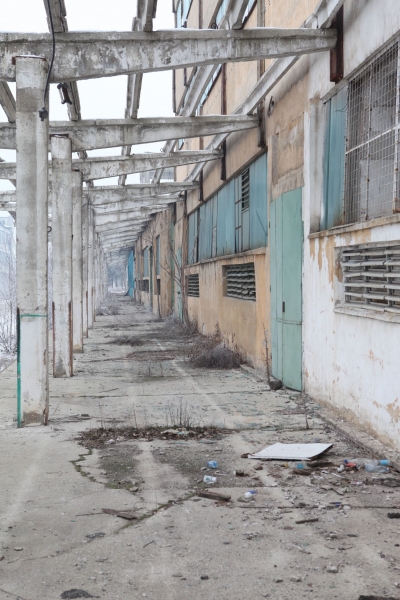
Where is `orange wall`? Image resolution: width=400 pixels, height=600 pixels. orange wall is located at coordinates (238, 320).